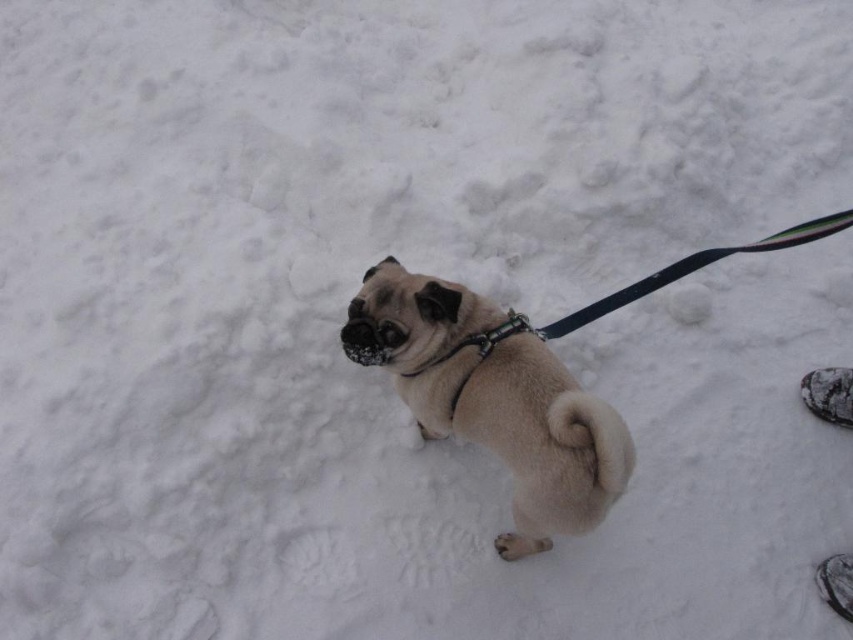
Looking at this image, you are a photographer setting up a tripod to take a portrait of the fuzzy beige dog at center and the metallic chain at center. Since you want to capture both subjects clearly, which one should you focus on first to ensure proper depth of field?

The fuzzy beige dog at center has a greater height compared to the metallic chain at center, so you should focus on the fuzzy beige dog at center first to ensure proper depth of field.

You are a photographer trying to capture a photo of the fuzzy beige dog at center and the metallic chain at center. From the perspective of the photographer, which object is positioned to the left?

The metallic chain at center is positioned to the left of the fuzzy beige dog at center.